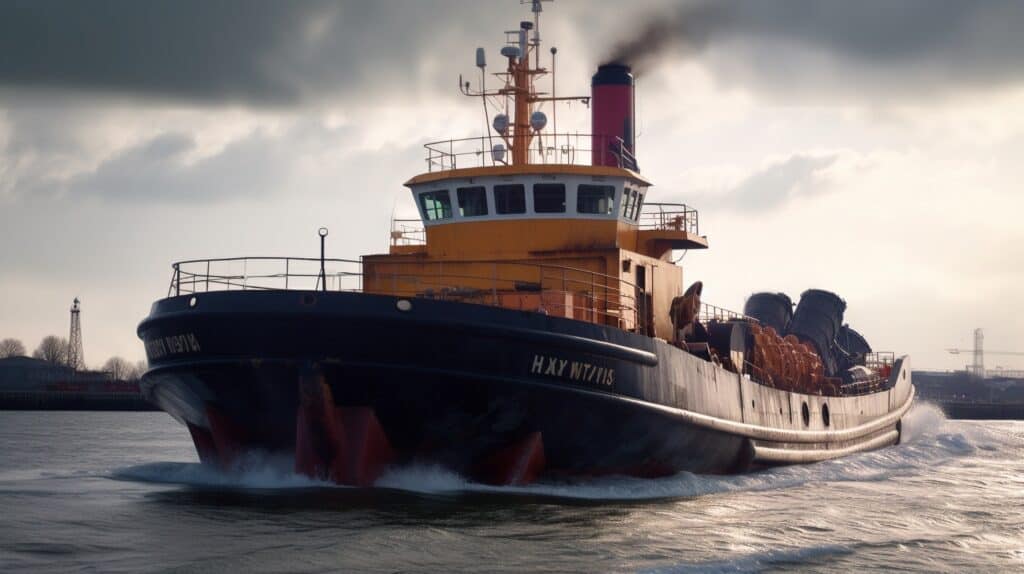
You are a GUI agent. You are given a task and a screenshot of the screen. Output one action in this format:
    pyautogui.click(x=<x>, y=<y>)
    Task: Click on the windows
    
    Given the screenshot: What is the action you would take?
    pyautogui.click(x=432, y=190), pyautogui.click(x=459, y=196), pyautogui.click(x=487, y=188), pyautogui.click(x=547, y=192), pyautogui.click(x=596, y=197)